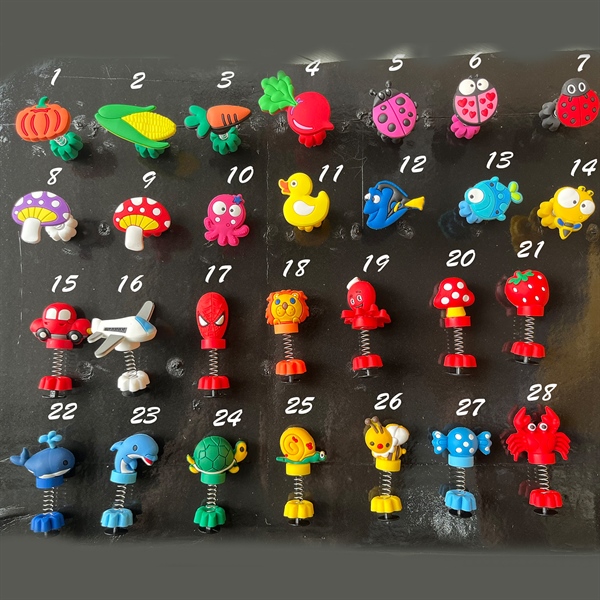
Image resolution: width=600 pixels, height=600 pixels. Find the location of `sixth column of toys`. sixth column of toys is located at coordinates (480, 93), (484, 201), (459, 296), (469, 442).